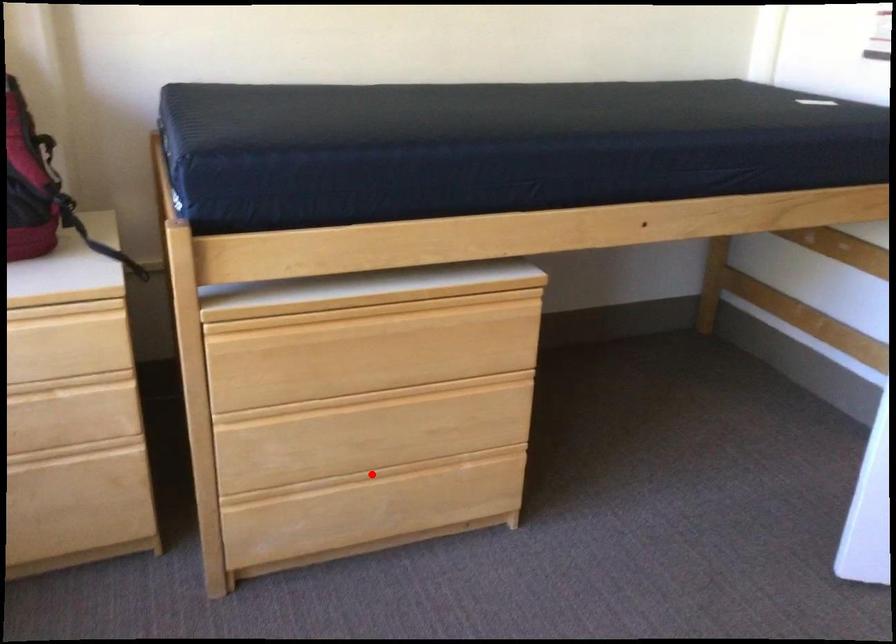
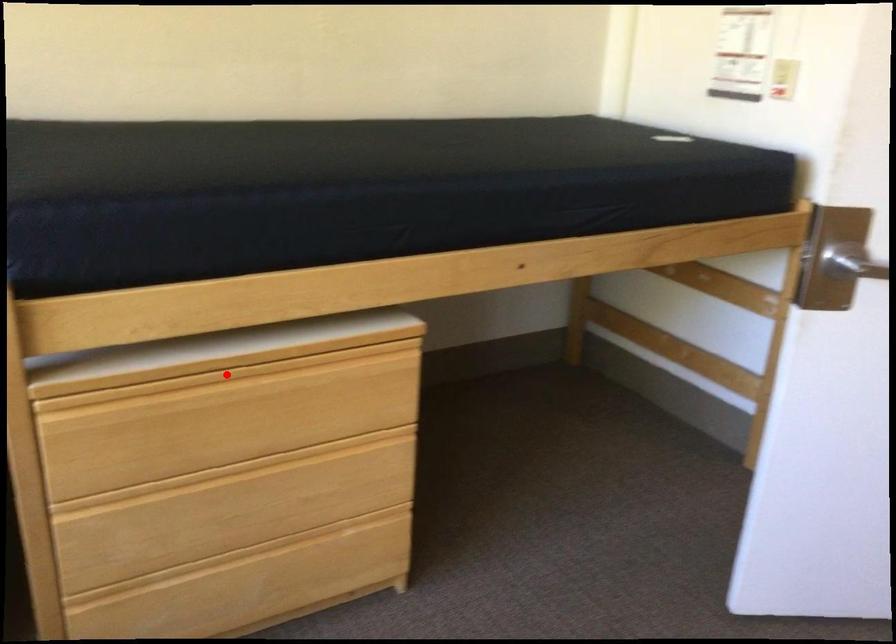
I am providing you with two images of the same scene from different viewpoints. A red point is marked on the first image and another point is marked on the second image. Does the point marked in image1 correspond to the same location as the one in image2?

No